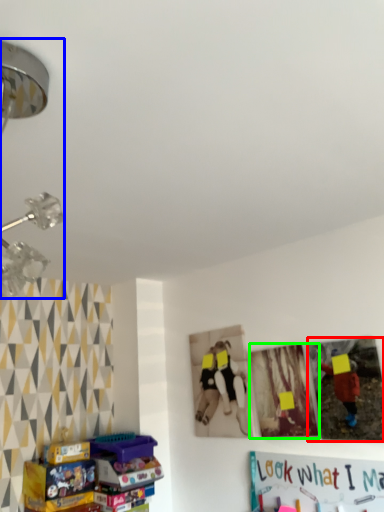
Question: Which object is positioned farthest from picture frame (highlighted by a red box)? Select from lamp (highlighted by a blue box) and picture frame (highlighted by a green box).

Choices:
 (A) lamp
 (B) picture frame

Answer: (A)